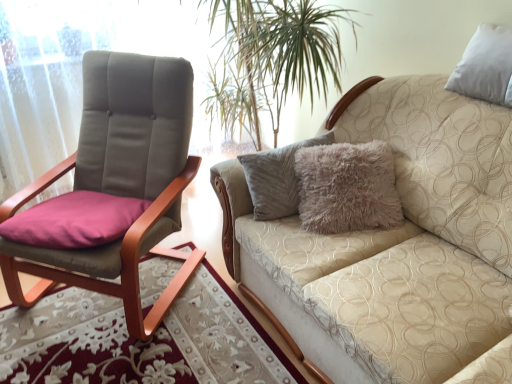
This screenshot has width=512, height=384. What do you see at coordinates (120, 181) in the screenshot?
I see `matte gray fabric chair at left` at bounding box center [120, 181].

Find the location of `matte gray fabric chair at left`. matte gray fabric chair at left is located at coordinates click(x=120, y=181).

What do you see at coordinates (395, 246) in the screenshot?
I see `beige textured couch at upper right` at bounding box center [395, 246].

Identify the location of beige textured couch at upper right. (395, 246).

Locate an element on the screen. This screenshot has height=384, width=512. matte gray fabric chair at left is located at coordinates (120, 181).

Does beige textured couch at upper right appear on the right side of matte gray fabric chair at left?

Yes.

Does beige textured couch at upper right come behind matte gray fabric chair at left?

No.

Is point (472, 163) positioned after point (10, 281)?

No.

Consider the image. From the image's perspective, which one is positioned higher, beige textured couch at upper right or matte gray fabric chair at left?

matte gray fabric chair at left.

From a real-world perspective, is beige textured couch at upper right below matte gray fabric chair at left?

Yes, from a real-world perspective, beige textured couch at upper right is beneath matte gray fabric chair at left.

Is beige textured couch at upper right thinner than matte gray fabric chair at left?

No.

Is beige textured couch at upper right shorter than matte gray fabric chair at left?

Correct, beige textured couch at upper right is not as tall as matte gray fabric chair at left.

Does beige textured couch at upper right have a smaller size compared to matte gray fabric chair at left?

Incorrect, beige textured couch at upper right is not smaller in size than matte gray fabric chair at left.

Is matte gray fabric chair at left inside beige textured couch at upper right?

No, matte gray fabric chair at left is not surrounded by beige textured couch at upper right.

Is beige textured couch at upper right positioned far away from matte gray fabric chair at left?

No.

Is beige textured couch at upper right oriented away from matte gray fabric chair at left?

beige textured couch at upper right is not turned away from matte gray fabric chair at left.

This screenshot has width=512, height=384. In order to click on studio couch that appears on the right of matte gray fabric chair at left in this screenshot , I will do `click(395, 246)`.

Considering the positions of objects matte gray fabric chair at left and beige textured couch at upper right in the image provided, who is more to the left, matte gray fabric chair at left or beige textured couch at upper right?

matte gray fabric chair at left is more to the left.

Which object is more forward, matte gray fabric chair at left or beige textured couch at upper right?

Positioned in front is beige textured couch at upper right.

Considering the positions of points (126, 301) and (375, 282), is point (126, 301) closer to camera compared to point (375, 282)?

No, it is behind (375, 282).

From the image's perspective, is matte gray fabric chair at left located beneath beige textured couch at upper right?

Actually, matte gray fabric chair at left appears above beige textured couch at upper right in the image.

From the picture: From a real-world perspective, is matte gray fabric chair at left above or below beige textured couch at upper right?

Clearly, from a real-world perspective, matte gray fabric chair at left is above beige textured couch at upper right.

Considering the sizes of matte gray fabric chair at left and beige textured couch at upper right in the image, is matte gray fabric chair at left wider or thinner than beige textured couch at upper right?

Clearly, matte gray fabric chair at left has less width compared to beige textured couch at upper right.

Considering the relative sizes of matte gray fabric chair at left and beige textured couch at upper right in the image provided, is matte gray fabric chair at left shorter than beige textured couch at upper right?

No, matte gray fabric chair at left is not shorter than beige textured couch at upper right.

Who is smaller, matte gray fabric chair at left or beige textured couch at upper right?

Smaller between the two is matte gray fabric chair at left.

Is beige textured couch at upper right inside matte gray fabric chair at left?

No, beige textured couch at upper right is not inside matte gray fabric chair at left.

Is matte gray fabric chair at left next to beige textured couch at upper right and touching it?

They are not placed beside each other.

Is matte gray fabric chair at left oriented towards beige textured couch at upper right?

No, matte gray fabric chair at left is not oriented towards beige textured couch at upper right.

Measure the distance between matte gray fabric chair at left and beige textured couch at upper right.

A distance of 26.23 inches exists between matte gray fabric chair at left and beige textured couch at upper right.

Identify the location of studio couch in front of the matte gray fabric chair at left. (395, 246).

At what (x,y) coordinates should I click in order to perform the action: click on chair above the beige textured couch at upper right (from the image's perspective). Please return your answer as a coordinate pair (x, y). Looking at the image, I should click on (120, 181).

Where is `studio couch on the right side of matte gray fabric chair at left`? The height and width of the screenshot is (384, 512). studio couch on the right side of matte gray fabric chair at left is located at coordinates (395, 246).